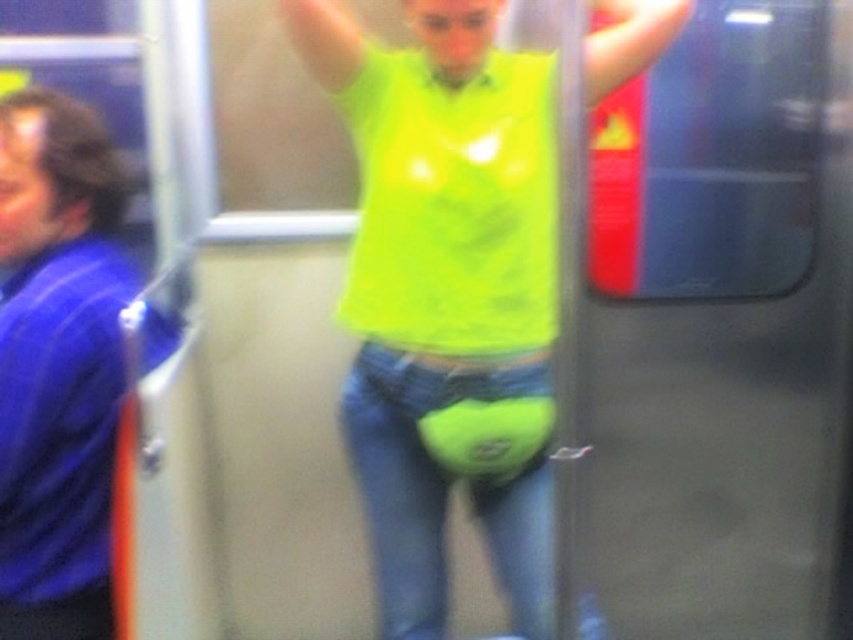
You are a passenger on a moving bus and need to reach the overhead luggage compartment. You see the neon yellow fabric at center and the blue fabric shirt at left. Which fabric is positioned higher in the scene?

The neon yellow fabric at center is located above the blue fabric shirt at left, so it is positioned higher in the scene.

You are a passenger on a moving bus and need to reach the neon yellow fabric at center and the blue fabric shirt at left. Which one is closer to your right side?

The neon yellow fabric at center is positioned on the right side of blue fabric shirt at left, so if you are facing forward, the neon yellow fabric at center would be closer to your right side.

You are standing in the public transportation vehicle and want to take a photo of the person in the neon yellow shirt. The camera you have can only focus on objects within 5 feet. Is the point at coordinates point (x=428, y=92) within the focus range of your camera?

The point at coordinates point (x=428, y=92) is 4.54 feet away from the camera, so yes, it is within the focus range of the camera since it is less than 5 feet away.